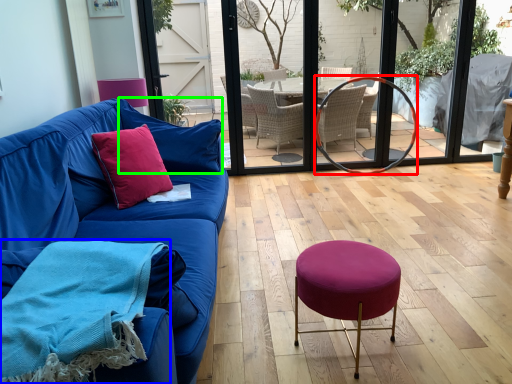
Question: Which is farther away from oval (highlighted by a red box)? blanket (highlighted by a blue box) or pillow (highlighted by a green box)?

Choices:
 (A) blanket
 (B) pillow

Answer: (A)